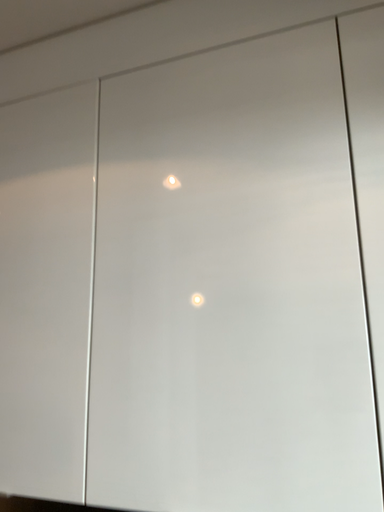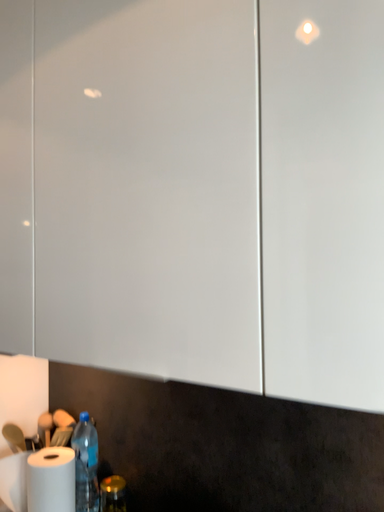
Question: Which way did the camera rotate in the video?

Choices:
 (A) rotated left
 (B) rotated right

Answer: (A)